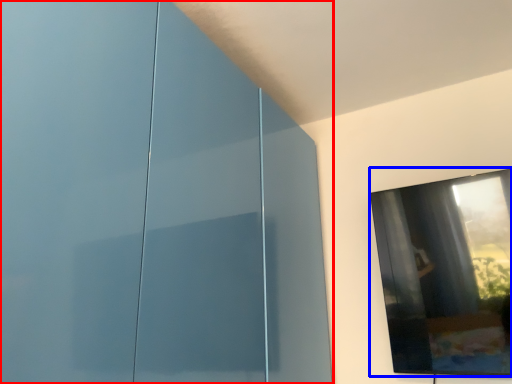
Question: Which point is closer to the camera, glass door (highlighted by a red box) or window (highlighted by a blue box)?

Choices:
 (A) glass door
 (B) window

Answer: (A)